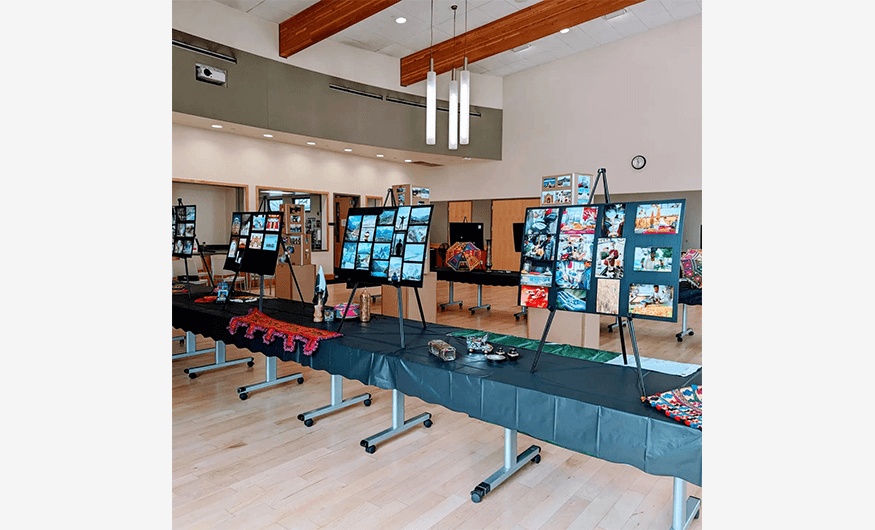
In order to click on poster in this screenshot , I will do `click(609, 254)`, `click(536, 231)`, `click(577, 238)`, `click(381, 232)`, `click(249, 233)`.